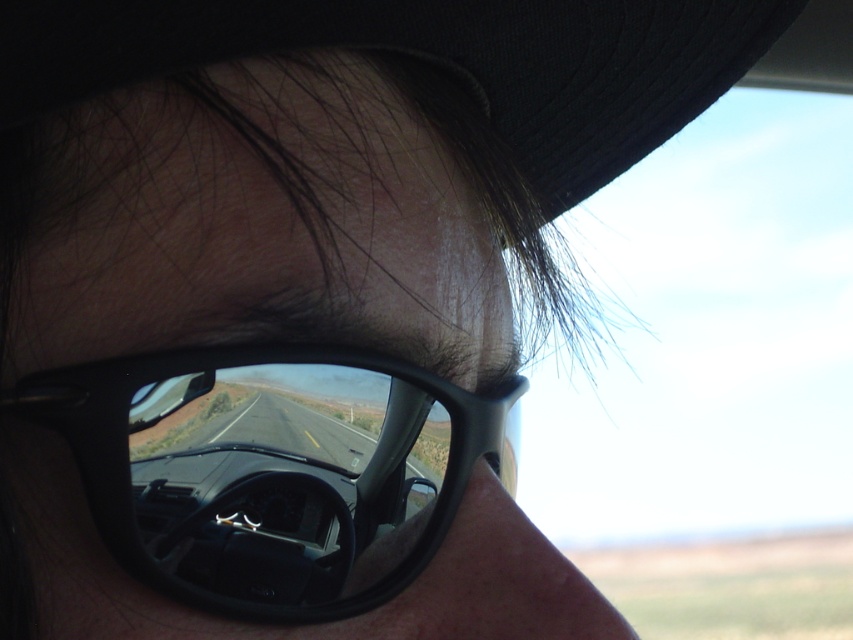
Question: Can you confirm if black plastic sunglasses at center is smaller than black fabric baseball hat at upper center?

Choices:
 (A) no
 (B) yes

Answer: (B)

Question: Can you confirm if black plastic sunglasses at center is bigger than black fabric baseball hat at upper center?

Choices:
 (A) no
 (B) yes

Answer: (A)

Question: Which point is farther to the camera?

Choices:
 (A) (108, 497)
 (B) (640, 61)

Answer: (B)

Question: From the image, what is the correct spatial relationship of black plastic sunglasses at center in relation to black fabric baseball hat at upper center?

Choices:
 (A) left
 (B) right

Answer: (A)

Question: Which point is farther to the camera?

Choices:
 (A) black plastic sunglasses at center
 (B) black fabric baseball hat at upper center

Answer: (A)